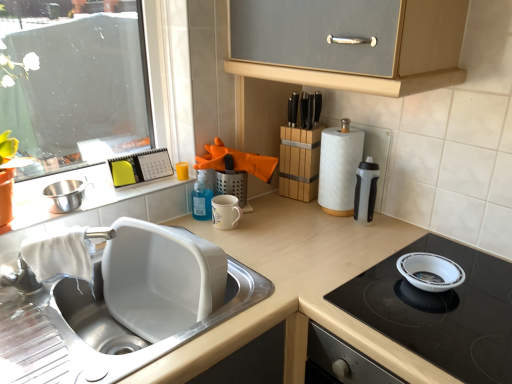
You are a GUI agent. You are given a task and a screenshot of the screen. Output one action in this format:
    pyautogui.click(x=<x>, y=<y>)
    Task: Click on the vacant area that is in front of translucent plastic water bottle at right
    The height and width of the screenshot is (384, 512).
    Given the screenshot: What is the action you would take?
    tap(364, 248)